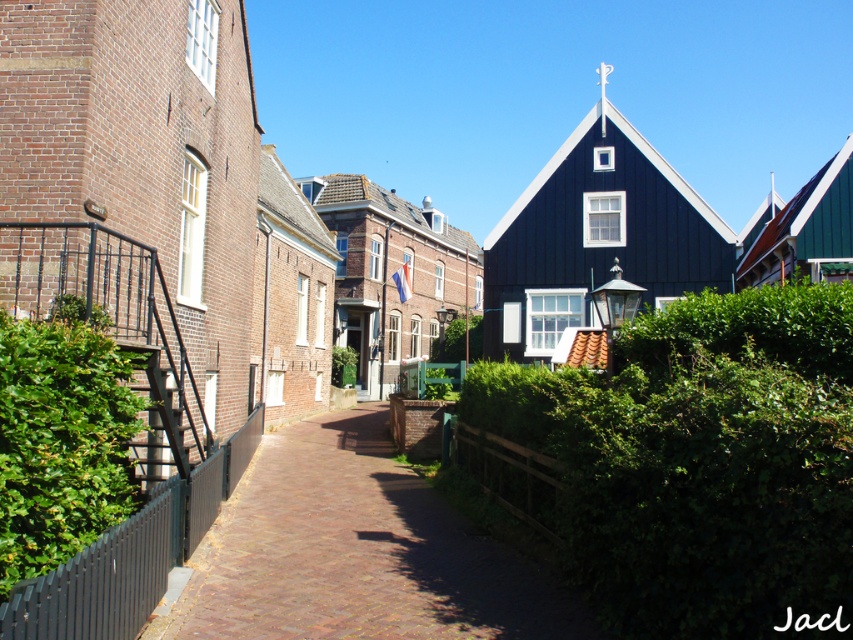
Does green leafy hedge at center have a greater width compared to black wooden house at center?

No.

Can you confirm if green leafy hedge at center is positioned to the left of black wooden house at center?

Yes, green leafy hedge at center is to the left of black wooden house at center.

Which is behind, point (825, 388) or point (643, 141)?

The point (643, 141) is behind.

The width and height of the screenshot is (853, 640). What are the coordinates of `green leafy hedge at center` in the screenshot? It's located at (700, 460).

Is green leafy hedge at center thinner than green leafy hedge at left?

In fact, green leafy hedge at center might be wider than green leafy hedge at left.

Which is behind, point (651, 513) or point (88, 481)?

Point (651, 513)

Is point (607, 572) more distant than point (119, 376)?

Yes.

Locate an element on the screen. green leafy hedge at center is located at coordinates (700, 460).

Does brick paved path at center have a greater height compared to brick textured church at center?

No, brick paved path at center is not taller than brick textured church at center.

Is brick paved path at center wider than brick textured church at center?

No.

Between point (276, 545) and point (437, 275), which one is positioned in front?

Point (276, 545)

Find the location of a particular element. brick paved path at center is located at coordinates (357, 552).